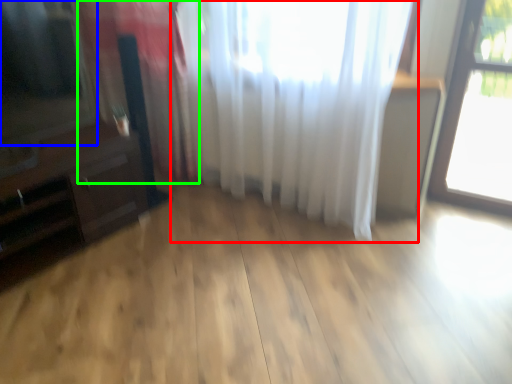
Question: Based on their relative distances, which object is farther from curtain (highlighted by a red box)? Choose from window screen (highlighted by a blue box) and curtain (highlighted by a green box).

Choices:
 (A) window screen
 (B) curtain

Answer: (A)